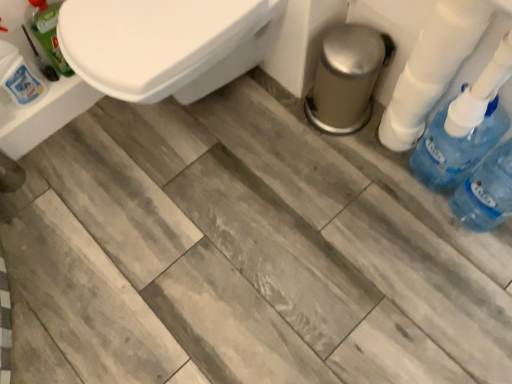
Question: Is white plastic toilet paper at right far away from translucent plastic bottle at upper left, the first cleaning product in the left-to-right sequence?

Choices:
 (A) no
 (B) yes

Answer: (B)

Question: From a real-world perspective, is white plastic toilet paper at right positioned over translucent plastic bottle at upper left, the third cleaning product when ordered from right to left, based on gravity?

Choices:
 (A) no
 (B) yes

Answer: (B)

Question: Is white plastic toilet paper at right turned away from translucent plastic bottle at upper left, the first cleaning product in the left-to-right sequence?

Choices:
 (A) no
 (B) yes

Answer: (A)

Question: Is white plastic toilet paper at right placed right next to translucent plastic bottle at upper left, the third cleaning product when ordered from right to left?

Choices:
 (A) yes
 (B) no

Answer: (B)

Question: From the image's perspective, does white plastic toilet paper at right appear higher than translucent plastic bottle at upper left, the third cleaning product when ordered from right to left?

Choices:
 (A) yes
 (B) no

Answer: (B)

Question: Is point (423, 172) positioned closer to the camera than point (53, 34)?

Choices:
 (A) farther
 (B) closer

Answer: (A)

Question: Considering the positions of blue plastic bottle at right, which ranks as the third cleaning product in left-to-right order, and translucent green bottle at upper left, marked as the second cleaning product in a right-to-left arrangement, in the image, is blue plastic bottle at right, which ranks as the third cleaning product in left-to-right order, bigger or smaller than translucent green bottle at upper left, marked as the second cleaning product in a right-to-left arrangement,?

Choices:
 (A) small
 (B) big

Answer: (B)

Question: From a real-world perspective, is blue plastic bottle at right, arranged as the 1th cleaning product when viewed from the right, physically located above or below translucent green bottle at upper left, the 2th cleaning product positioned from the left?

Choices:
 (A) below
 (B) above

Answer: (A)

Question: Relative to translucent green bottle at upper left, the 2th cleaning product positioned from the left, is blue plastic bottle at right, which ranks as the third cleaning product in left-to-right order, in front or behind?

Choices:
 (A) behind
 (B) front

Answer: (B)

Question: Based on their positions, is blue translucent bottle at right located to the left or right of translucent plastic bottle at upper left, the first cleaning product in the left-to-right sequence?

Choices:
 (A) right
 (B) left

Answer: (A)

Question: Does point (471, 187) appear closer or farther from the camera than point (10, 74)?

Choices:
 (A) farther
 (B) closer

Answer: (B)

Question: Based on their sizes in the image, would you say blue translucent bottle at right is bigger or smaller than translucent plastic bottle at upper left, the third cleaning product when ordered from right to left?

Choices:
 (A) big
 (B) small

Answer: (A)

Question: Is blue translucent bottle at right wider or thinner than translucent plastic bottle at upper left, the third cleaning product when ordered from right to left?

Choices:
 (A) thin
 (B) wide

Answer: (B)

Question: From a real-world perspective, relative to white plastic toilet paper at right, is blue translucent bottle at right vertically above or below?

Choices:
 (A) below
 (B) above

Answer: (A)

Question: Does point (451, 200) appear closer or farther from the camera than point (425, 43)?

Choices:
 (A) farther
 (B) closer

Answer: (A)